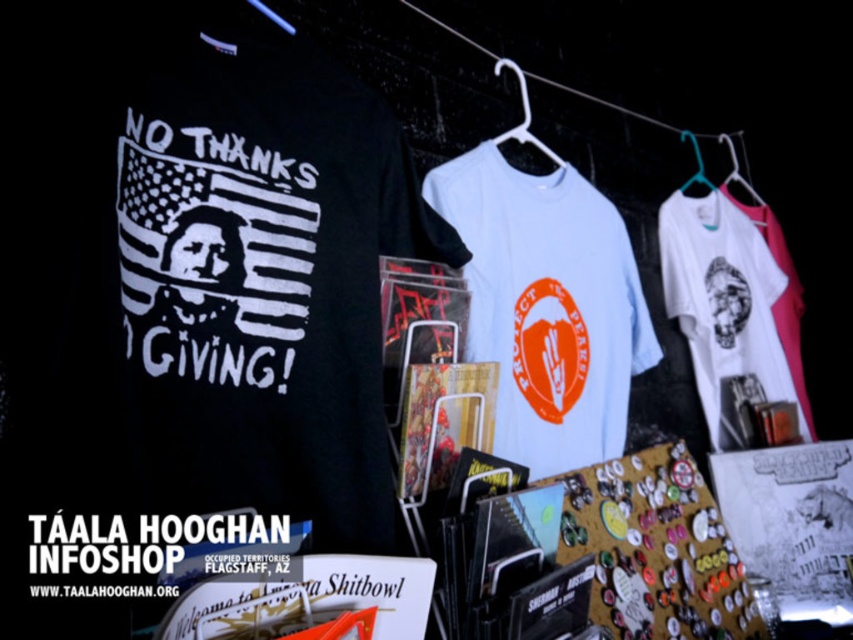
Looking at this image, can you confirm if white matte t-shirt at upper right is positioned above white fabric shirt at upper center?

No.

Is point (698, 204) positioned after point (722, 140)?

No, it is not.

Between point (714, 404) and point (763, 198), which one is positioned in front?

Positioned in front is point (714, 404).

The image size is (853, 640). What are the coordinates of `white matte t-shirt at upper right` in the screenshot? It's located at 722,298.

Based on the photo, which is below, black matte t-shirt at left or white matte t-shirt at upper right?

white matte t-shirt at upper right

Does black matte t-shirt at left lie in front of white matte t-shirt at upper right?

Yes, black matte t-shirt at left is closer to the viewer.

The width and height of the screenshot is (853, 640). Describe the element at coordinates (264, 285) in the screenshot. I see `black matte t-shirt at left` at that location.

The height and width of the screenshot is (640, 853). In order to click on black matte t-shirt at left in this screenshot , I will do `click(264, 285)`.

Between light blue cotton t-shirt at center and white matte t-shirt at upper right, which one appears on the left side from the viewer's perspective?

light blue cotton t-shirt at center is more to the left.

Measure the distance between point (515, 456) and camera.

Point (515, 456) is 1.32 meters away from camera.

This screenshot has height=640, width=853. I want to click on light blue cotton t-shirt at center, so click(547, 307).